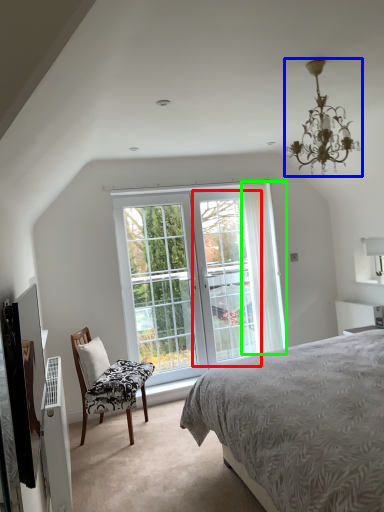
Question: Which is farther away from screen door (highlighted by a red box)? light fixture (highlighted by a blue box) or curtain (highlighted by a green box)?

Choices:
 (A) light fixture
 (B) curtain

Answer: (A)